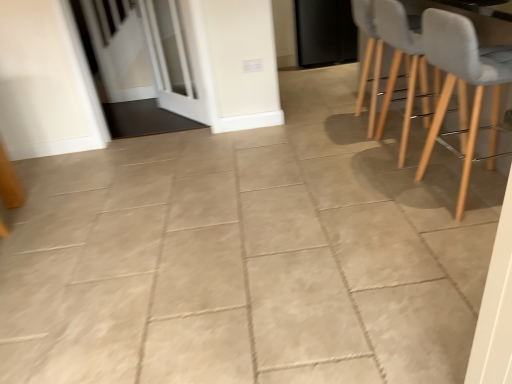
Question: Is light gray fabric chair at right, the 1th chair in the front-to-back sequence, inside or outside of light gray fabric chair at right, marked as the second chair in a front-to-back arrangement?

Choices:
 (A) inside
 (B) outside

Answer: (B)

Question: Looking at the image, does light gray fabric chair at right, the 1th chair in the front-to-back sequence, seem bigger or smaller compared to light gray fabric chair at right, which is the 1th chair in back-to-front order?

Choices:
 (A) big
 (B) small

Answer: (B)

Question: Based on their relative distances, which object is nearer to the white glossy screen door at upper left, the 2th screen door viewed from the front?

Choices:
 (A) light gray fabric chair at upper right
 (B) black matte door at upper center
 (C) light gray fabric chair at right, marked as the second chair in a front-to-back arrangement
 (D) light gray fabric chair at right, which appears as the 2th chair when viewed from the back
 (E) white glass screen door at upper left, the 1th screen door in the front-to-back sequence

Answer: (E)

Question: Based on their relative distances, which object is nearer to the white glossy screen door at upper left, the first screen door positioned from the back?

Choices:
 (A) white glass screen door at upper left, which appears as the 2th screen door when viewed from the back
 (B) black matte door at upper center
 (C) light gray fabric chair at right, which appears as the 2th chair when viewed from the back
 (D) light gray fabric chair at upper right
 (E) light gray fabric chair at right, marked as the second chair in a front-to-back arrangement

Answer: (A)